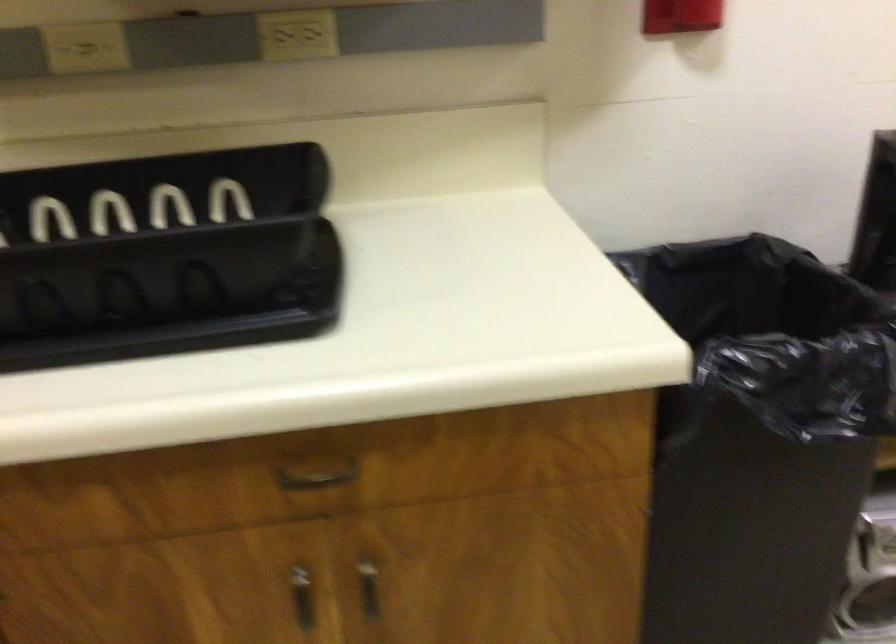
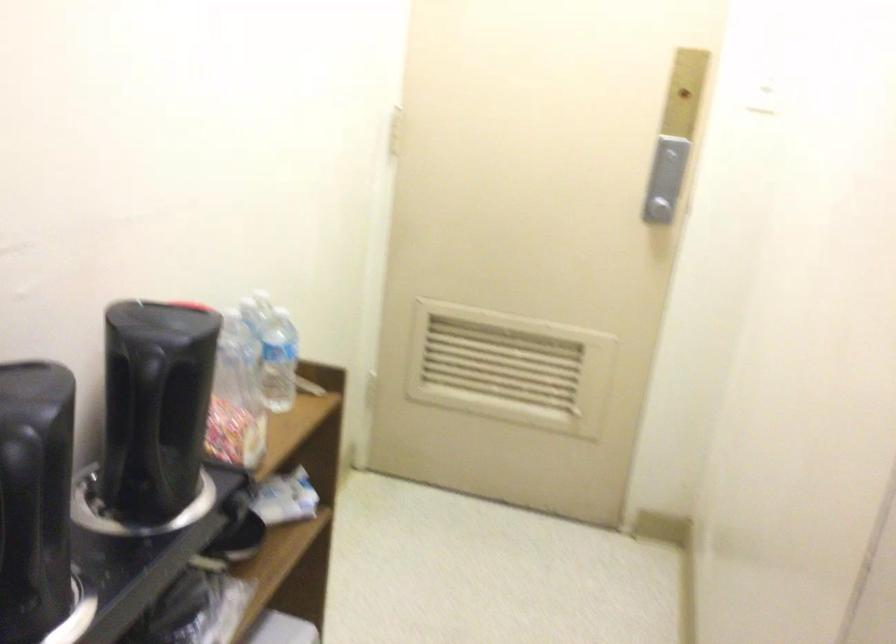
Question: The camera is either moving clockwise (left) or counter-clockwise (right) around the object. The first image is from the beginning of the video and the second image is from the end. Is the camera moving left or right when shooting the video?

Choices:
 (A) Left
 (B) Right

Answer: (A)